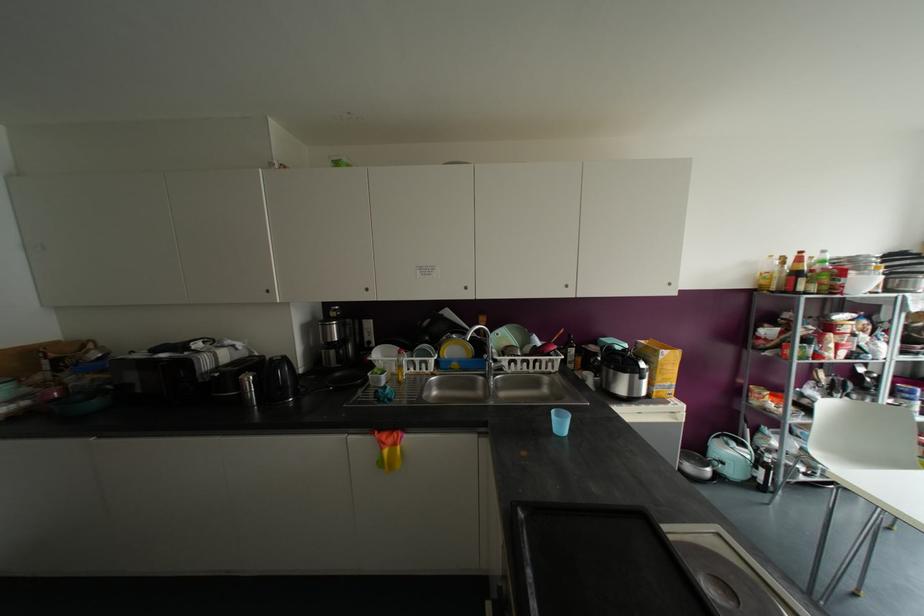
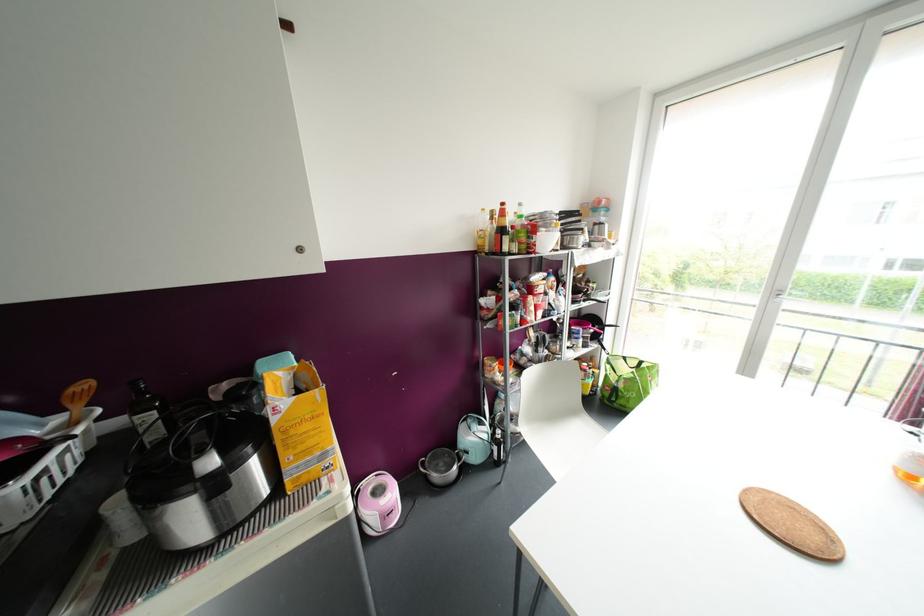
Locate, in the second image, the point that corresponds to point 800,252 in the first image.

(502, 204)